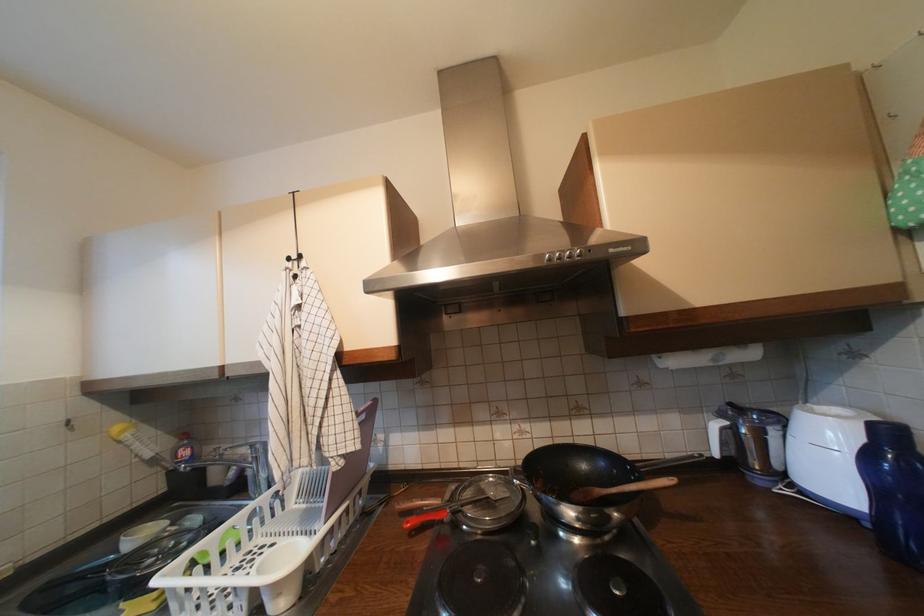
The height and width of the screenshot is (616, 924). What are the coordinates of `food processor bowl handle` in the screenshot? It's located at (779, 446).